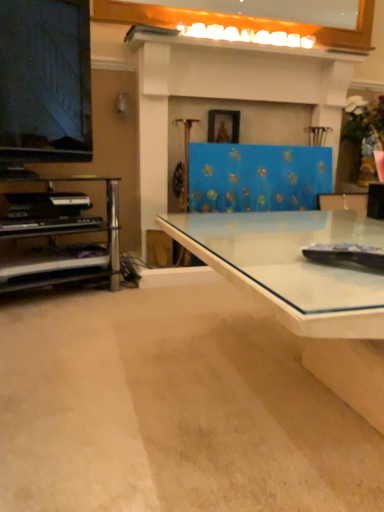
Question: Is metallic silver shelf at left facing away from transparent glass desk at center?

Choices:
 (A) no
 (B) yes

Answer: (A)

Question: Does metallic silver shelf at left have a greater width compared to transparent glass desk at center?

Choices:
 (A) yes
 (B) no

Answer: (B)

Question: Is metallic silver shelf at left closer to the viewer compared to transparent glass desk at center?

Choices:
 (A) no
 (B) yes

Answer: (A)

Question: From a real-world perspective, is metallic silver shelf at left below transparent glass desk at center?

Choices:
 (A) no
 (B) yes

Answer: (A)

Question: Does metallic silver shelf at left have a larger size compared to transparent glass desk at center?

Choices:
 (A) yes
 (B) no

Answer: (B)

Question: Considering the relative sizes of metallic silver shelf at left and transparent glass desk at center in the image provided, is metallic silver shelf at left smaller than transparent glass desk at center?

Choices:
 (A) yes
 (B) no

Answer: (A)

Question: Does matte black television at left have a smaller size compared to transparent glass desk at center?

Choices:
 (A) no
 (B) yes

Answer: (B)

Question: Considering the relative sizes of matte black television at left and transparent glass desk at center in the image provided, is matte black television at left shorter than transparent glass desk at center?

Choices:
 (A) no
 (B) yes

Answer: (A)

Question: From a real-world perspective, is matte black television at left over transparent glass desk at center?

Choices:
 (A) no
 (B) yes

Answer: (B)

Question: From the image's perspective, does matte black television at left appear lower than transparent glass desk at center?

Choices:
 (A) yes
 (B) no

Answer: (B)

Question: Is matte black television at left positioned behind transparent glass desk at center?

Choices:
 (A) no
 (B) yes

Answer: (B)

Question: From the image's perspective, would you say matte black television at left is positioned over transparent glass desk at center?

Choices:
 (A) no
 (B) yes

Answer: (B)

Question: Is metallic silver shelf at left facing towards white glossy mantle at upper center?

Choices:
 (A) no
 (B) yes

Answer: (A)